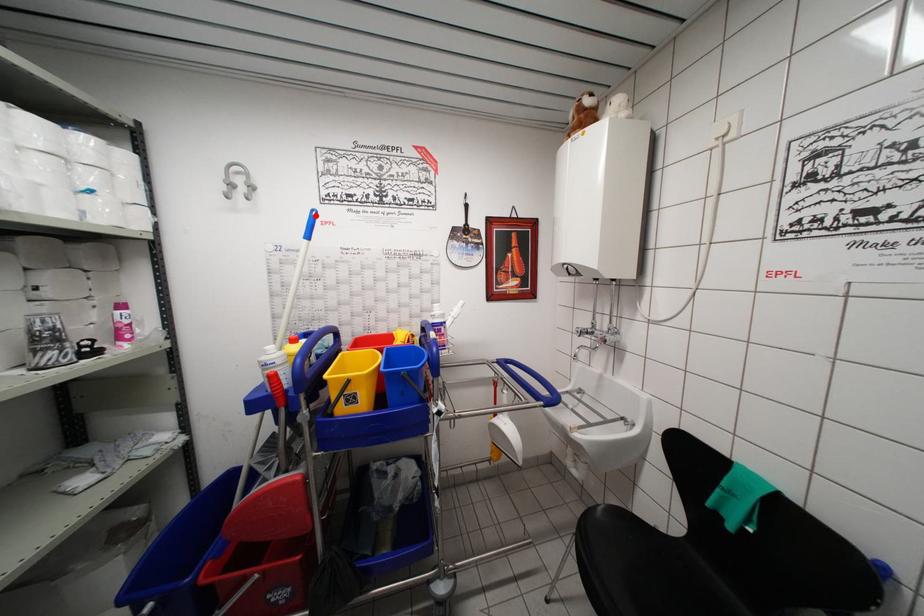
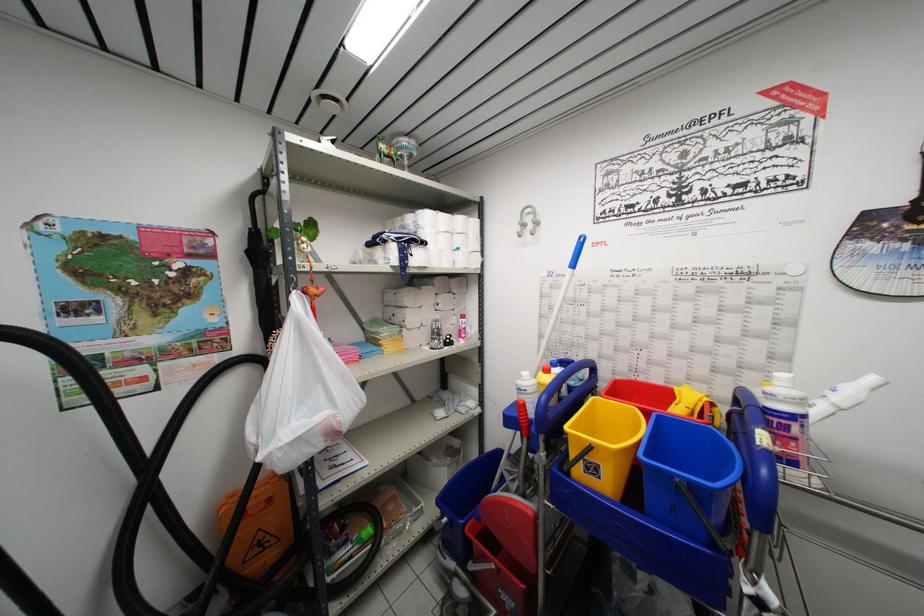
Question: I am providing you with two images of the same scene from different viewpoints. A red point is marked on the first image. Is the red point's position out of view in image 2?

Choices:
 (A) Yes
 (B) No

Answer: (B)